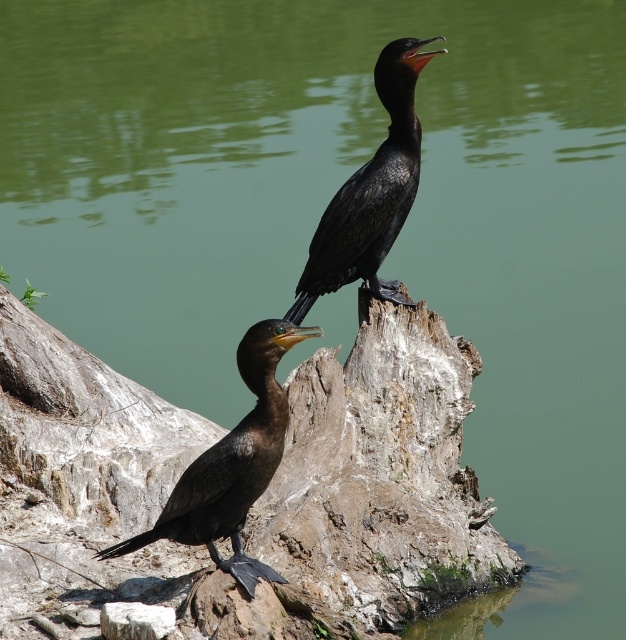
Which is below, shiny black bird at lower left or shiny black bird at center?

shiny black bird at lower left is lower down.

Image resolution: width=626 pixels, height=640 pixels. What do you see at coordinates (232, 464) in the screenshot? I see `shiny black bird at lower left` at bounding box center [232, 464].

Does point (220, 456) come in front of point (357, 212)?

Yes, point (220, 456) is in front of point (357, 212).

I want to click on shiny black bird at lower left, so click(232, 464).